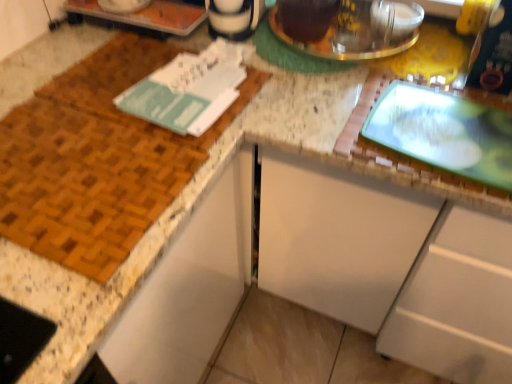
Question: Is shiny metallic kettle at upper center inside white matte cabinet at center?

Choices:
 (A) no
 (B) yes

Answer: (A)

Question: Is white matte cabinet at center taller than shiny metallic kettle at upper center?

Choices:
 (A) no
 (B) yes

Answer: (B)

Question: Considering the relative sizes of white matte cabinet at center and shiny metallic kettle at upper center in the image provided, is white matte cabinet at center shorter than shiny metallic kettle at upper center?

Choices:
 (A) yes
 (B) no

Answer: (B)

Question: Is white matte cabinet at center not close to shiny metallic kettle at upper center?

Choices:
 (A) yes
 (B) no

Answer: (B)

Question: Is white matte cabinet at center at the left side of shiny metallic kettle at upper center?

Choices:
 (A) yes
 (B) no

Answer: (B)

Question: From the image's perspective, would you say white matte cabinet at center is positioned over shiny metallic kettle at upper center?

Choices:
 (A) no
 (B) yes

Answer: (A)

Question: Would you say teal paper journal at upper left is outside white matte cabinet at center?

Choices:
 (A) no
 (B) yes

Answer: (B)

Question: Can you confirm if teal paper journal at upper left is shorter than white matte cabinet at center?

Choices:
 (A) yes
 (B) no

Answer: (A)

Question: Is teal paper journal at upper left positioned far away from white matte cabinet at center?

Choices:
 (A) yes
 (B) no

Answer: (B)

Question: Does teal paper journal at upper left come in front of white matte cabinet at center?

Choices:
 (A) yes
 (B) no

Answer: (B)

Question: From the image's perspective, is teal paper journal at upper left over white matte cabinet at center?

Choices:
 (A) yes
 (B) no

Answer: (A)

Question: From a real-world perspective, does teal paper journal at upper left sit lower than white matte cabinet at center?

Choices:
 (A) no
 (B) yes

Answer: (A)

Question: From a real-world perspective, is teal paper journal at upper left over shiny metallic kettle at upper center?

Choices:
 (A) yes
 (B) no

Answer: (A)